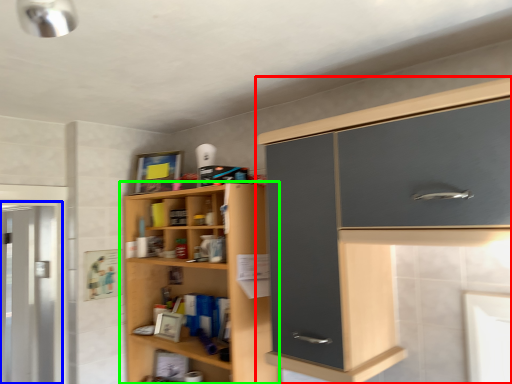
Question: Which object is positioned closest to cabinetry (highlighted by a red box)? Select from screen door (highlighted by a blue box) and cupboard (highlighted by a green box).

Choices:
 (A) screen door
 (B) cupboard

Answer: (B)